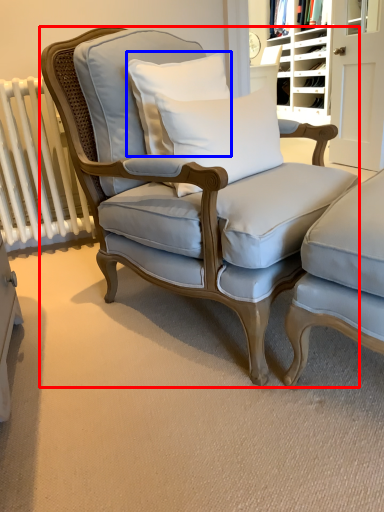
Question: Which point is closer to the camera, chair (highlighted by a red box) or pillow (highlighted by a blue box)?

Choices:
 (A) chair
 (B) pillow

Answer: (A)